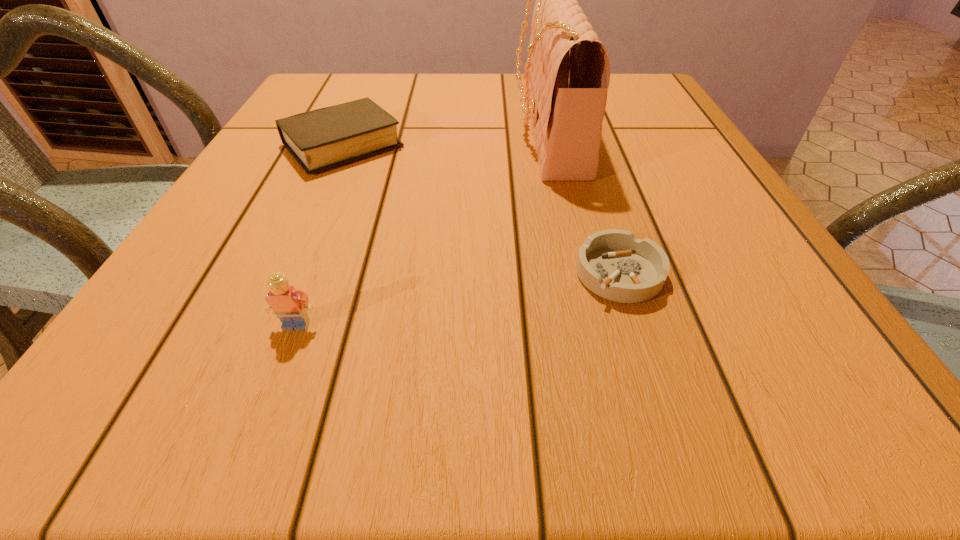
Find the location of a particular element. the tallest object is located at coordinates (567, 73).

Find the location of `the second tallest object`. the second tallest object is located at coordinates (x=290, y=305).

The image size is (960, 540). Find the location of `the nearest object`. the nearest object is located at coordinates (290, 305).

Locate an element on the screen. Image resolution: width=960 pixels, height=540 pixels. Bible is located at coordinates (324, 138).

The width and height of the screenshot is (960, 540). I want to click on the shortest object, so click(x=614, y=264).

Where is `ashtray`? The height and width of the screenshot is (540, 960). ashtray is located at coordinates (614, 264).

The width and height of the screenshot is (960, 540). What are the coordinates of `free region located 0.180m on the front-facing side of the tallest object` in the screenshot? It's located at (432, 132).

The image size is (960, 540). What are the coordinates of `blank space located on the front-facing side of the tallest object` in the screenshot? It's located at (358, 132).

This screenshot has width=960, height=540. I want to click on blank space located 0.080m on the front-facing side of the tallest object, so click(478, 132).

Find the location of a particular element. Image resolution: width=960 pixels, height=540 pixels. free space located 0.060m on the front-facing side of the third shortest object is located at coordinates (279, 372).